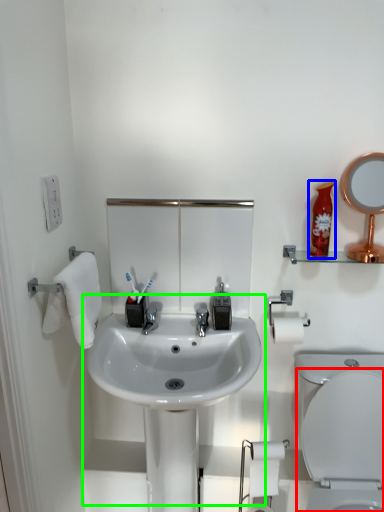
Question: Which object is the closest to the toilet (highlighted by a red box)? Choose among these: mouthwash (highlighted by a blue box) or sink (highlighted by a green box).

Choices:
 (A) mouthwash
 (B) sink

Answer: (B)